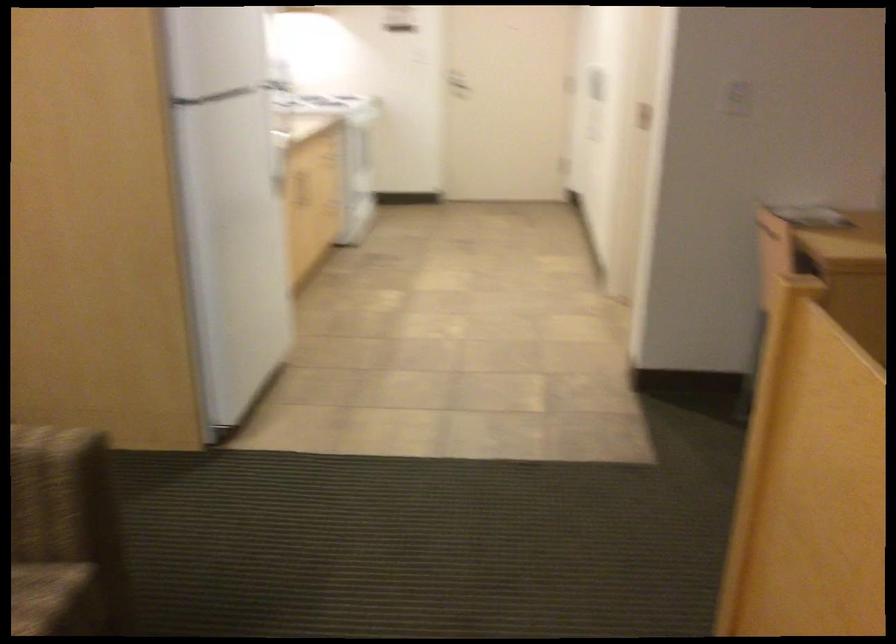
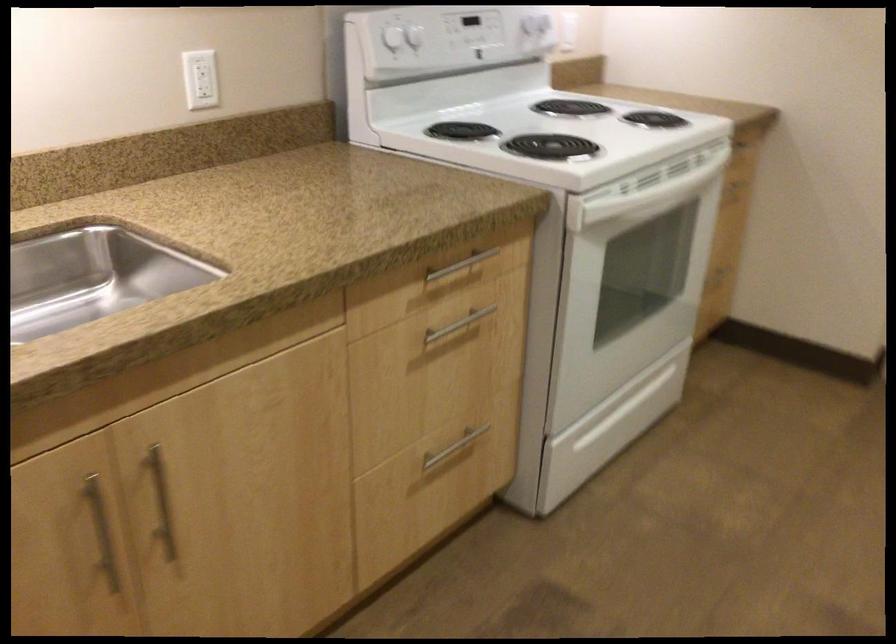
In the second image, find the point that corresponds to point 321,183 in the first image.

(161, 502)